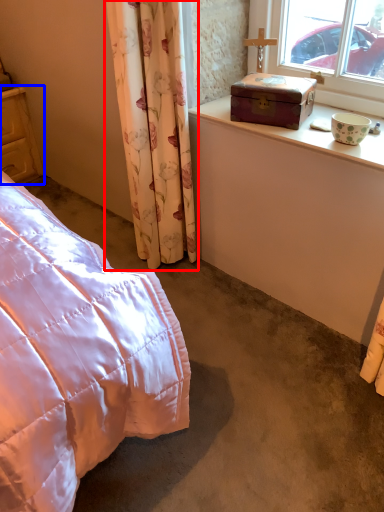
Question: Which point is further to the camera, curtain (highlighted by a red box) or cupboard (highlighted by a blue box)?

Choices:
 (A) curtain
 (B) cupboard

Answer: (B)